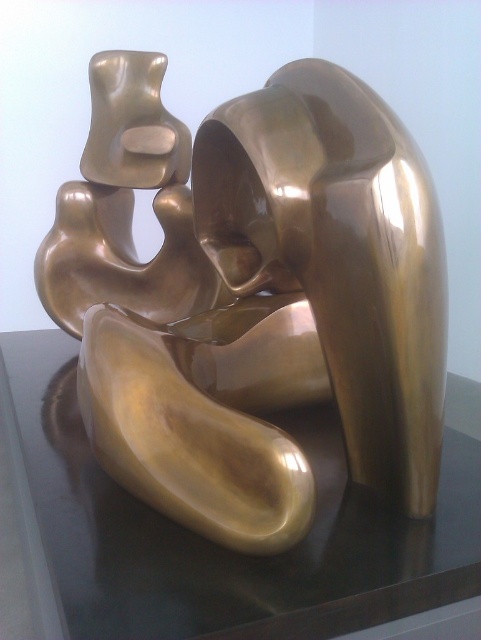
From the picture: You are an art curator arranging a new exhibit. You have a gold polished sculpture at center and a transparent glass table at center. Which object is closer to the viewer?

The gold polished sculpture at center is closer to the viewer than the transparent glass table at center because the transparent glass table at center is behind the gold polished sculpture at center.

You are an interior designer planning to place a tall floor lamp next to the gold polished sculpture at center and transparent glass table at center. Which object should the lamp be placed closer to if it needs to cast light on the taller object?

The gold polished sculpture at center is taller than the transparent glass table at center, so the lamp should be placed closer to the gold polished sculpture at center to cast light on it effectively.

You are an interior designer planning to place a large rectangular plant stand that is 1.2 meters wide between the gold polished sculpture at center and the transparent glass table at center. Based on the scene, will the plant stand fit between them?

The gold polished sculpture at center has a lesser width compared to transparent glass table at center. However, the description does not provide information about the distance between them, so it is impossible to determine if the plant stand will fit.